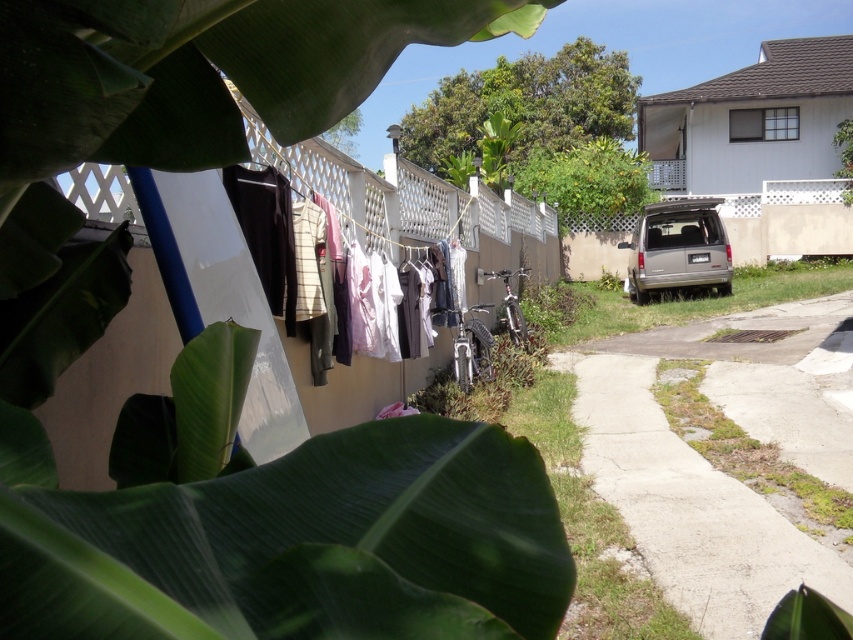
You are a gardener who needs to water both the green leafy plant at right and the green grass at lower right. If your watering can holds enough water for 10 meters of travel, can you water both without refilling?

The green leafy plant at right and green grass at lower right are 11.85 meters apart from each other. Since the distance exceeds the watering can capacity of 10 meters, you cannot water both without refilling.

In the scene shown: You are standing in the residential outdoor area and want to hang a new white cotton shirt on the clothesline. The clothesline has the white cotton shirts at center and the green leafy plant at right. Which object is shorter, allowing you to hang the shirt without obstruction?

The white cotton shirts at center is shorter than the green leafy plant at right, so you can hang the new shirt there without obstruction.

You are standing in the residential outdoor area and want to walk towards the green grass at lower right. Is the green leafy plant at right blocking your path?

The green grass at lower right is behind the green leafy plant at right, so the plant is blocking the path to the grass.